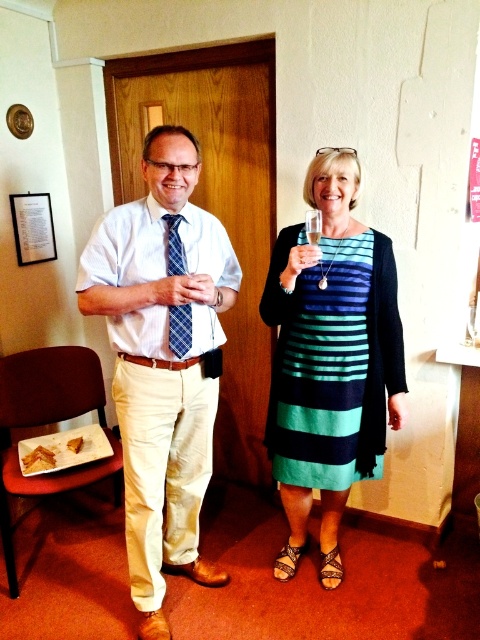
Who is lower down, matte blue tie at center or teal striped dress at center?

Positioned lower is teal striped dress at center.

Is matte blue tie at center bigger than teal striped dress at center?

Indeed, matte blue tie at center has a larger size compared to teal striped dress at center.

You are a GUI agent. You are given a task and a screenshot of the screen. Output one action in this format:
    pyautogui.click(x=<x>, y=<y>)
    Task: Click on the matte blue tie at center
    This screenshot has width=480, height=640.
    Given the screenshot: What is the action you would take?
    pyautogui.click(x=163, y=358)